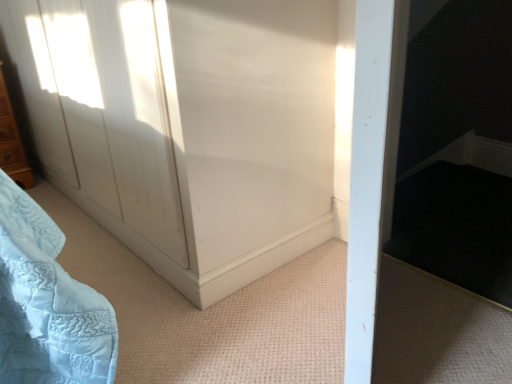
Question: Does white glossy door at upper left come in front of wooden dresser at left?

Choices:
 (A) no
 (B) yes

Answer: (B)

Question: Is white glossy door at upper left bigger than wooden dresser at left?

Choices:
 (A) no
 (B) yes

Answer: (B)

Question: From the image's perspective, would you say white glossy door at upper left is shown under wooden dresser at left?

Choices:
 (A) no
 (B) yes

Answer: (A)

Question: Does white glossy door at upper left have a lesser width compared to wooden dresser at left?

Choices:
 (A) yes
 (B) no

Answer: (B)

Question: Is white glossy door at upper left at the right side of wooden dresser at left?

Choices:
 (A) no
 (B) yes

Answer: (B)

Question: Does white glossy door at upper left have a lesser height compared to wooden dresser at left?

Choices:
 (A) yes
 (B) no

Answer: (B)

Question: From the image's perspective, is wooden dresser at left over white glossy door at upper left?

Choices:
 (A) no
 (B) yes

Answer: (A)

Question: Can you confirm if wooden dresser at left is smaller than white glossy door at upper left?

Choices:
 (A) no
 (B) yes

Answer: (B)

Question: From a real-world perspective, is wooden dresser at left located beneath white glossy door at upper left?

Choices:
 (A) no
 (B) yes

Answer: (B)

Question: Does wooden dresser at left have a greater width compared to white glossy door at upper left?

Choices:
 (A) yes
 (B) no

Answer: (B)

Question: Considering the relative sizes of wooden dresser at left and white glossy door at upper left in the image provided, is wooden dresser at left shorter than white glossy door at upper left?

Choices:
 (A) no
 (B) yes

Answer: (B)

Question: Is wooden dresser at left taller than white glossy door at upper left?

Choices:
 (A) yes
 (B) no

Answer: (B)

Question: Relative to wooden dresser at left, is white glossy door at upper left in front or behind?

Choices:
 (A) front
 (B) behind

Answer: (A)